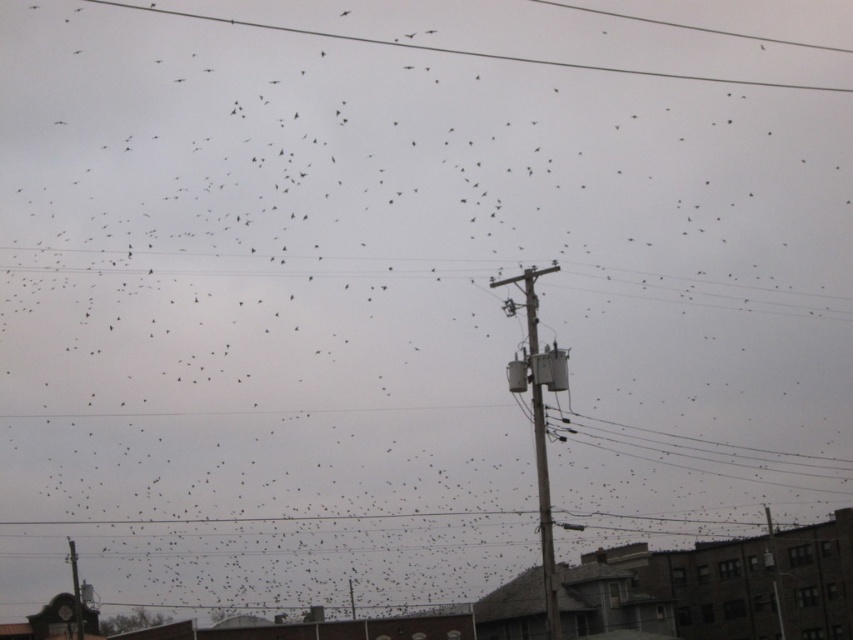
Based on the photo, you are standing at the camera position and want to reach the point at coordinates (531,337). Given that your walking speed is 1.5 meters per second, how many seconds will it take you to reach that point?

Answer: The point at coordinates (531,337) is 50.85 meters from the camera. At a walking speed of 1.5 meters per second, it would take 50.85 divided by 1.5, which equals approximately 33.9 seconds to reach that point.

You are an electrician assessing the scene. You notice the wooden utility pole at center and the smooth wire at upper center. Which object has a smaller diameter?

The wooden utility pole at center is thinner than the smooth wire at upper center, so the wooden utility pole at center has a smaller diameter.